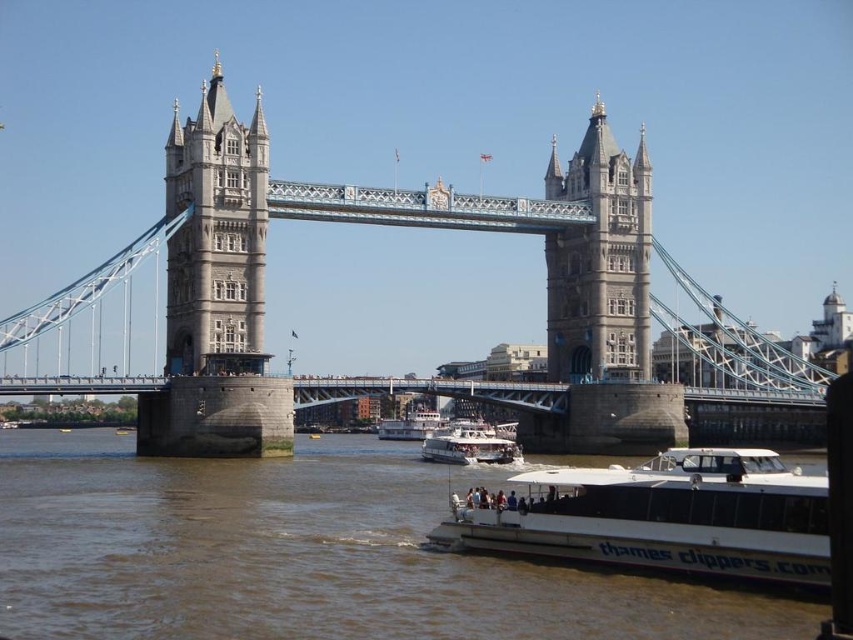
You are standing at the camera position and want to take a photo of the white stone tower at upper left. If your camera has a maximum focus range of 300 feet, will you be able to capture the tower clearly?

The white stone tower at upper left and camera are 340.13 feet apart. Since the distance exceeds the camera maximum focus range of 300 feet, you won not be able to capture the tower clearly.

You are standing at the point labeled point (599, 260). What object is located at that point?

The gray stone tower at center is located at point (599, 260).

You are a tourist standing on the Tower Bridge and want to take a photo of both the white matte boat at lower right and the white glossy boat at center. Which boat should you position yourself closer to in order to include both in your frame?

You should position yourself closer to the white glossy boat at center because the white matte boat at lower right is on its right side, so centering the white glossy boat will allow both boats to be captured in the frame.